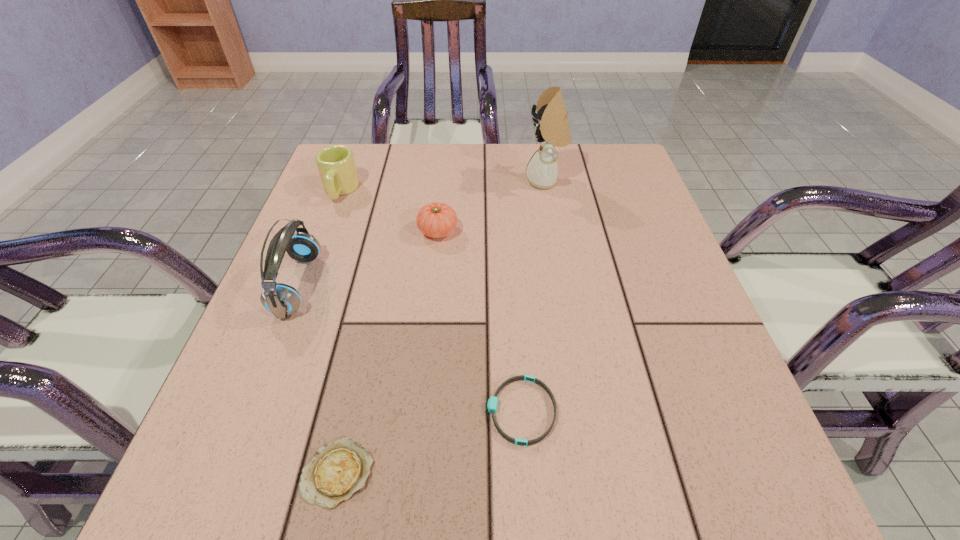
Locate an element on the screen. The width and height of the screenshot is (960, 540). mug present at the far edge is located at coordinates (336, 165).

Locate an element on the screen. object at the near edge is located at coordinates (339, 469).

Identify the location of headset that is positioned at the left edge. (282, 300).

Identify the location of mug situated at the left edge. (336, 165).

Where is `quiche that is at the left edge`? quiche that is at the left edge is located at coordinates (339, 469).

Where is `object that is at the far left corner`? Image resolution: width=960 pixels, height=540 pixels. object that is at the far left corner is located at coordinates (336, 165).

I want to click on object located at the near left corner, so (x=339, y=469).

What are the coordinates of `vacant space at the far edge of the desktop` in the screenshot? It's located at (572, 170).

The width and height of the screenshot is (960, 540). In order to click on free space at the left edge of the desktop in this screenshot , I will do click(x=291, y=282).

Identify the location of vacant space at the right edge of the desktop. (624, 341).